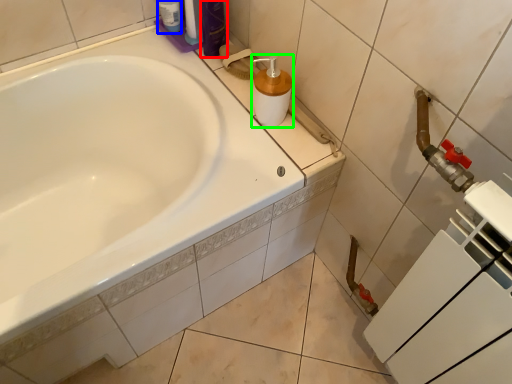
Question: Estimate the real-world distances between objects in this image. Which object is farther from toiletry (highlighted by a red box), toiletry (highlighted by a blue box) or soap dispenser (highlighted by a green box)?

Choices:
 (A) toiletry
 (B) soap dispenser

Answer: (B)